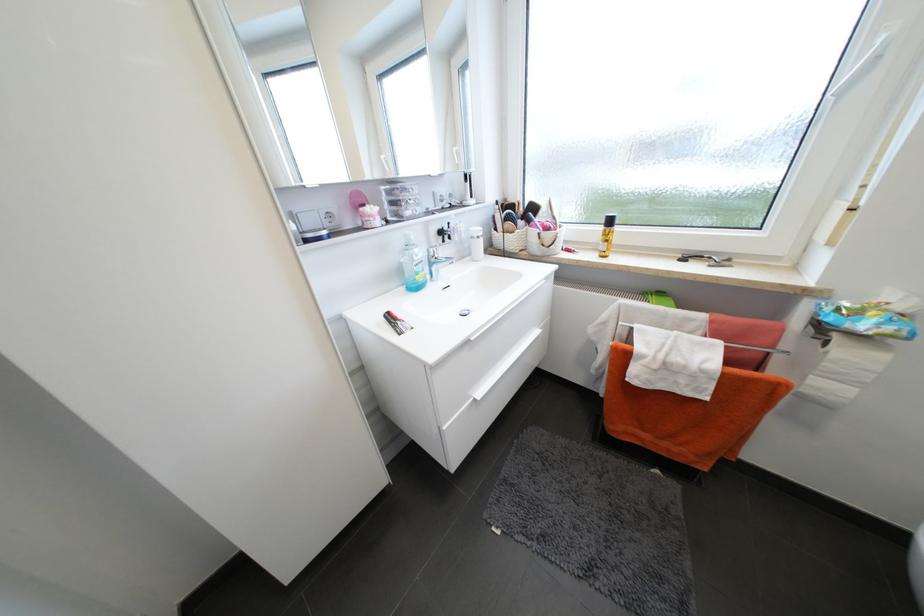
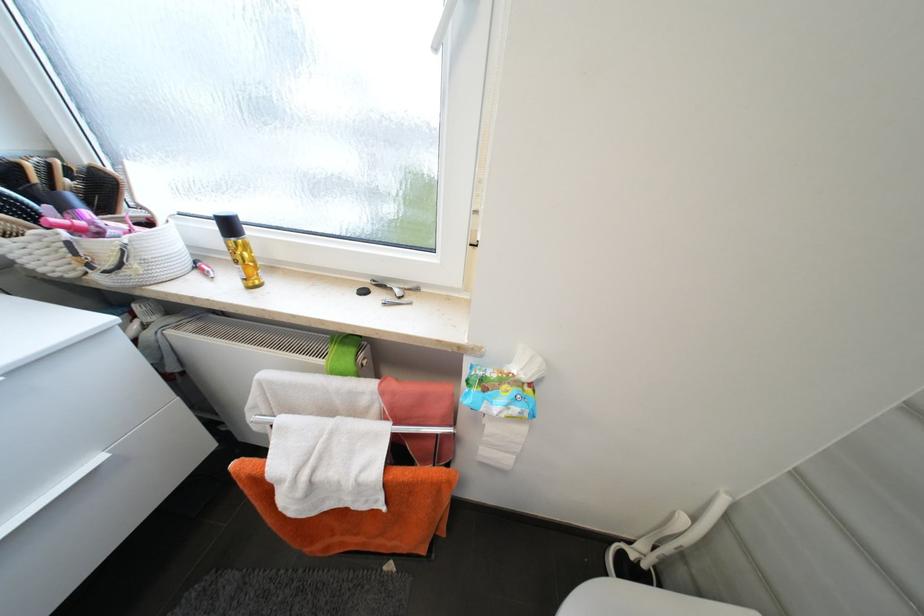
Question: The images are taken continuously from a first-person perspective. In which direction is your viewpoint rotating?

Choices:
 (A) Left
 (B) Right
 (C) Up
 (D) Down

Answer: (B)